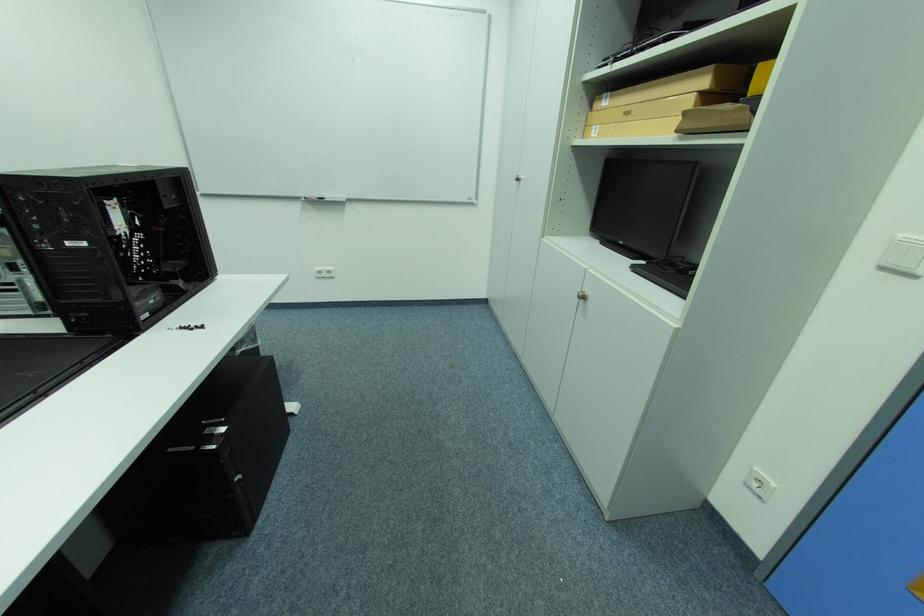
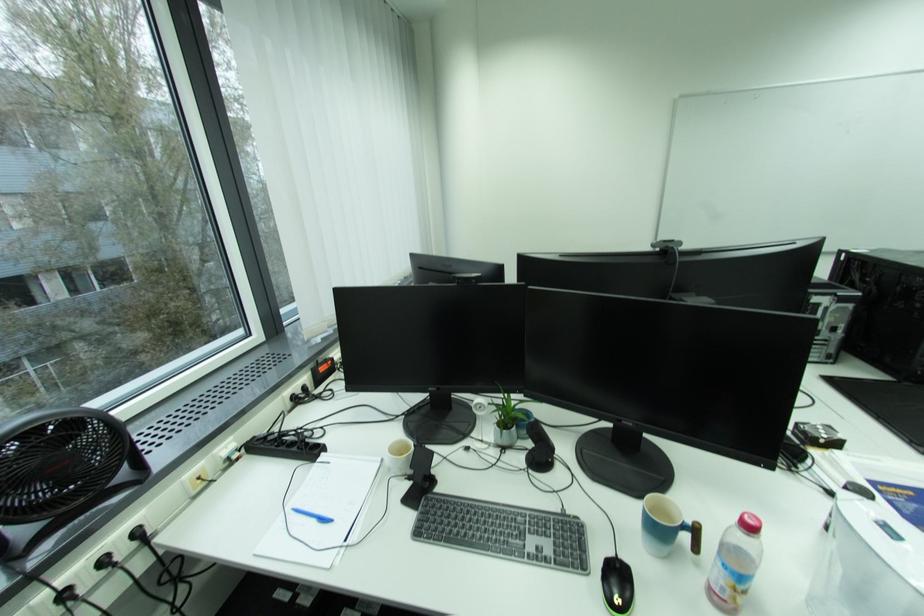
In a continuous first-person perspective shot, in which direction is the camera moving?

The cameraman walked toward left, backward.